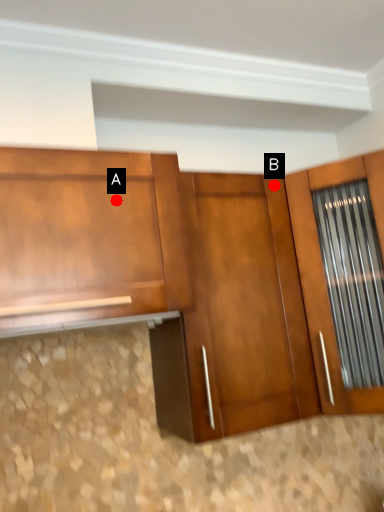
Question: Two points are circled on the image, labeled by A and B beside each circle. Which of the following is the closest to the observer?

Choices:
 (A) A is closer
 (B) B is closer

Answer: (A)